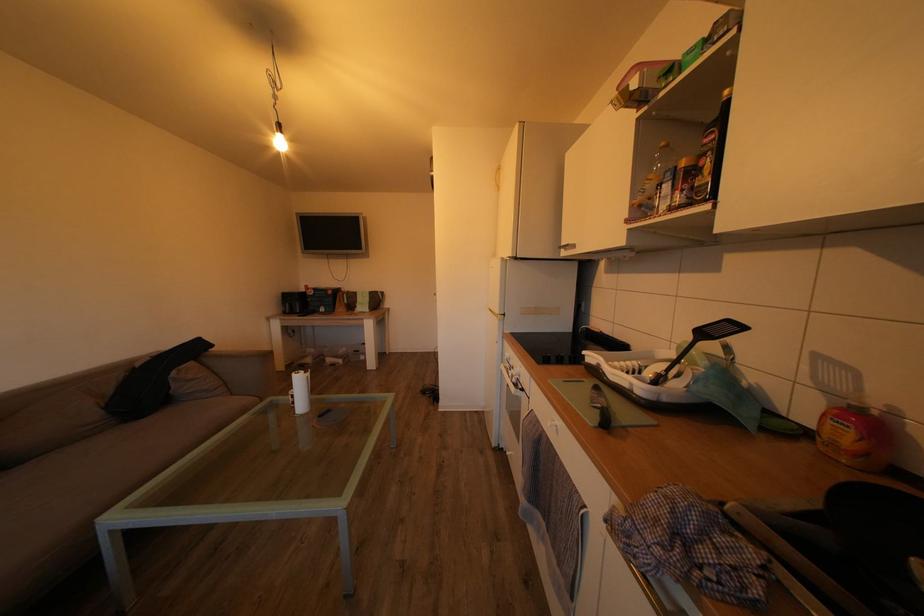
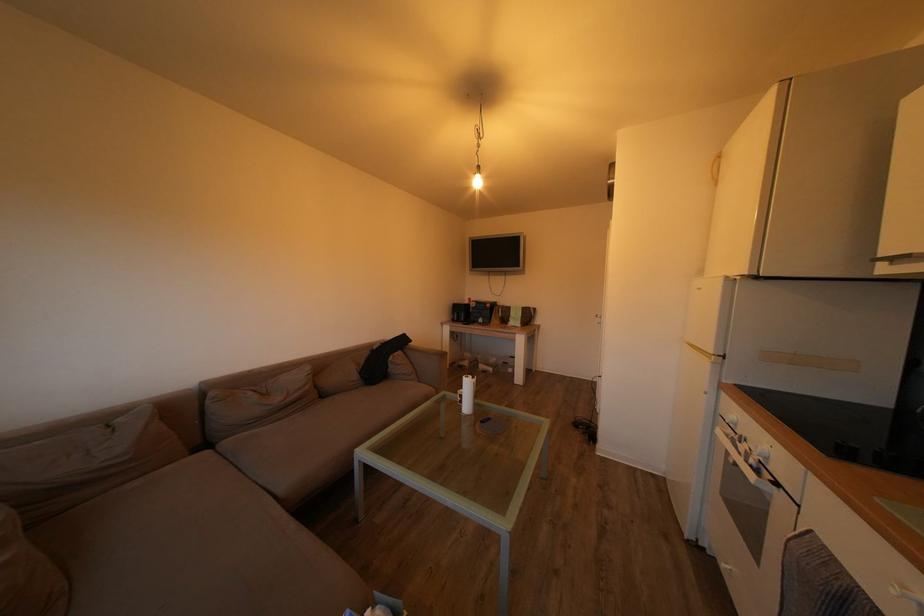
Where in the second image is the point corresponding to the point at 362,300 from the first image?

(517, 314)